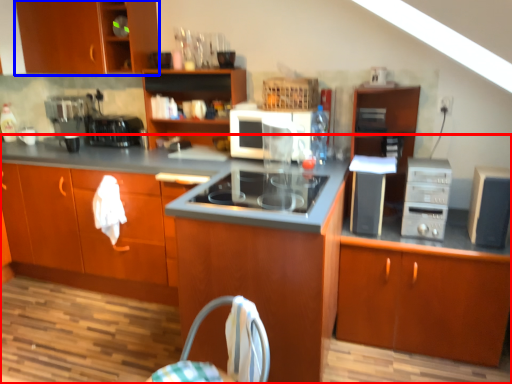
Question: Which point is closer to the camera, cabinetry (highlighted by a red box) or cabinetry (highlighted by a blue box)?

Choices:
 (A) cabinetry
 (B) cabinetry

Answer: (A)